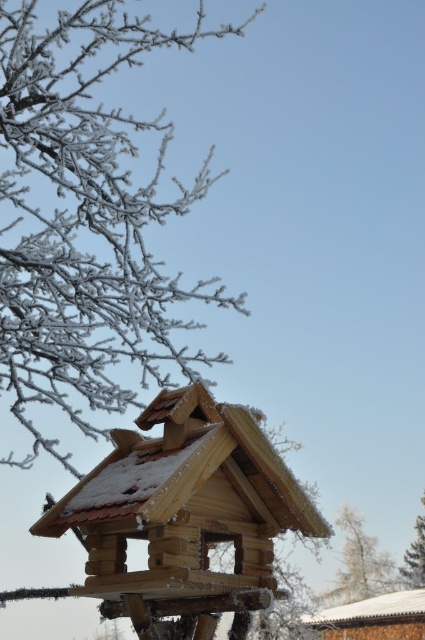
Question: Can you confirm if wooden hut at lower right is smaller than white frosty tree at lower right?

Choices:
 (A) yes
 (B) no

Answer: (B)

Question: Which of the following is the farthest from the observer?

Choices:
 (A) (79, 116)
 (B) (407, 552)

Answer: (B)

Question: In this image, where is wooden hut at lower center located relative to wooden hut at lower right?

Choices:
 (A) above
 (B) below

Answer: (A)

Question: Does wooden hut at lower center have a larger size compared to wooden hut at lower right?

Choices:
 (A) yes
 (B) no

Answer: (A)

Question: Estimate the real-world distances between objects in this image. Which object is closer to the frosted branches at upper left?

Choices:
 (A) frosty wood tree at upper left
 (B) wooden hut at lower right
 (C) white frosty tree at lower right
 (D) wooden hut at lower center

Answer: (D)

Question: Which point appears closest to the camera in this image?

Choices:
 (A) (408, 552)
 (B) (360, 540)
 (C) (379, 614)

Answer: (B)